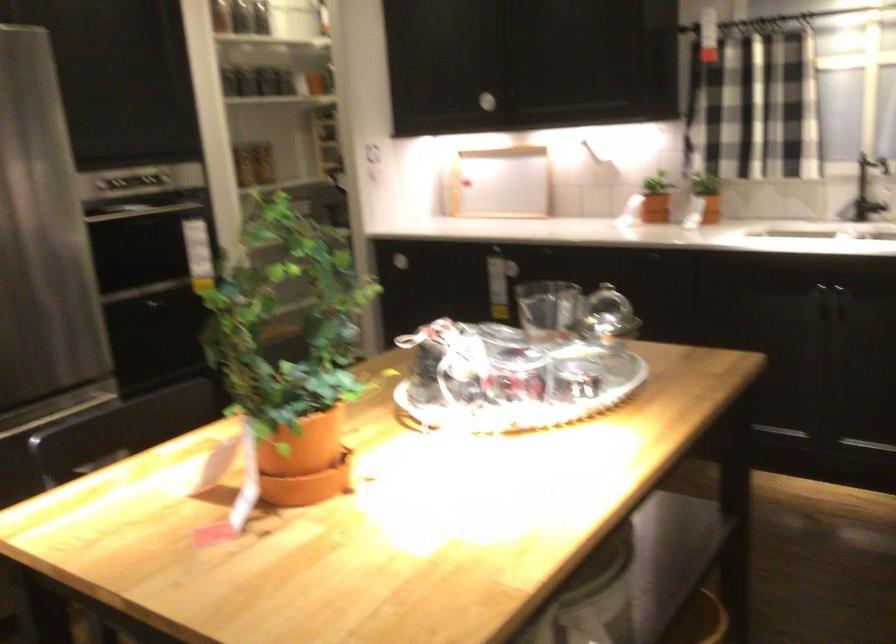
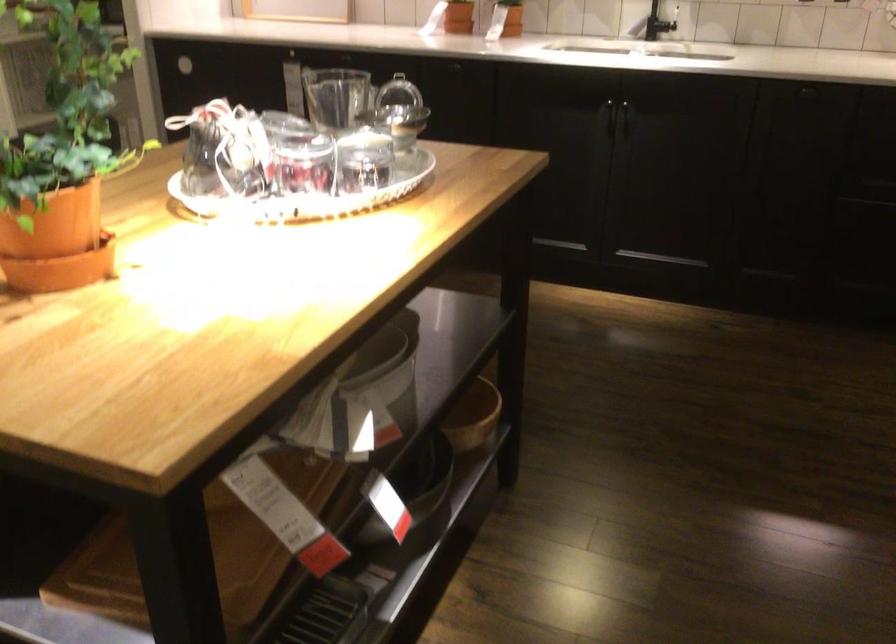
Find the pixel in the second image that matches point 297,464 in the first image.

(57, 239)